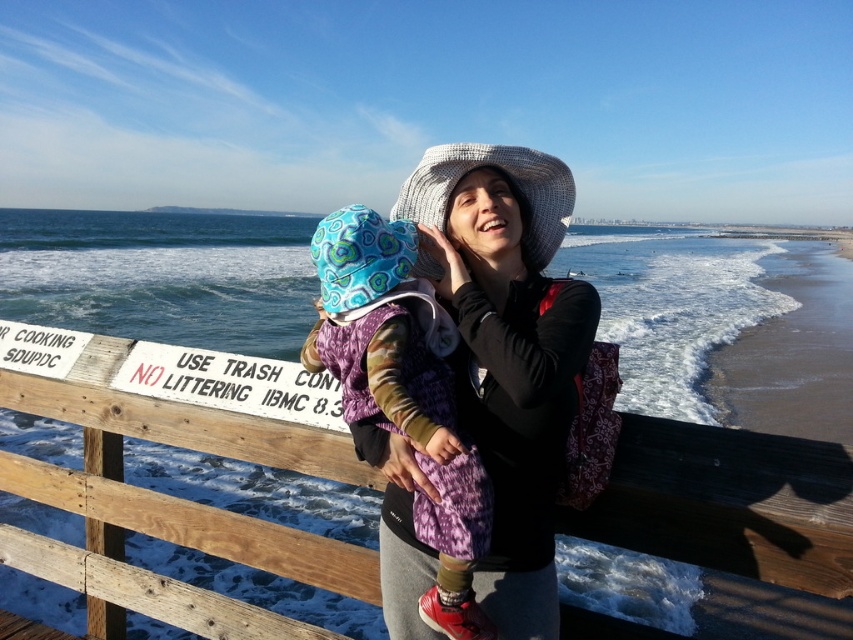
You are a photographer trying to capture the knitted wool hat at center and the sandy beach at lower right in the same frame. Based on their positions, which object should you focus on first to ensure both are in the shot?

The knitted wool hat at center is shorter than the sandy beach at lower right, so you should focus on the knitted wool hat at center first to ensure both are in the shot.

You are a photographer positioned at the center of the scene. You want to take a photo that includes both the wooden at center and the knitted wool hat at center. Which object should you pan your camera to the right to include in the frame first?

The wooden at center is to the left of the knitted wool hat at center, so you should pan your camera to the right to include the wooden at center first before capturing the knitted wool hat at center.